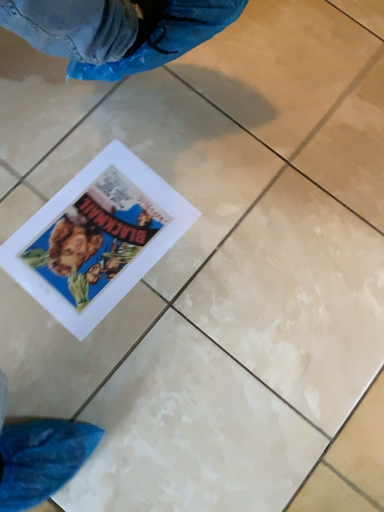
Locate an element on the screen. Image resolution: width=384 pixels, height=512 pixels. vacant space that is to the left of blue matte poster at center is located at coordinates (26, 168).